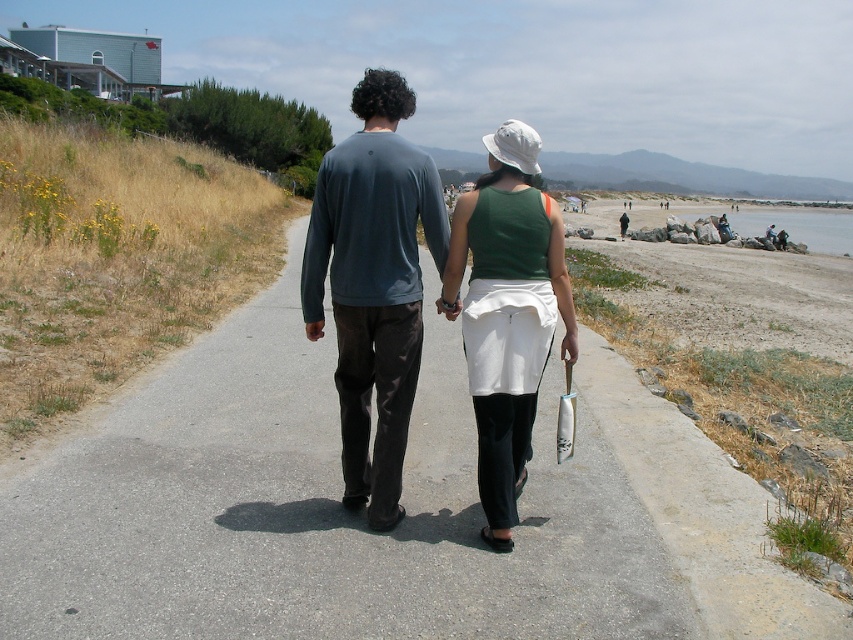
How distant is asphalt road at center from green fabric tank top at center?

asphalt road at center is 2.05 meters from green fabric tank top at center.

Is asphalt road at center positioned at the back of green fabric tank top at center?

No, asphalt road at center is closer to the viewer.

Which is in front, point (144, 458) or point (486, 204)?

Point (486, 204) is in front.

This screenshot has height=640, width=853. Identify the location of asphalt road at center. (316, 509).

Looking at this image, how distant is dark gray sweater at center from green fabric tank top at center?

dark gray sweater at center is 29.49 inches away from green fabric tank top at center.

Looking at this image, does dark gray sweater at center appear on the right side of green fabric tank top at center?

No, dark gray sweater at center is not to the right of green fabric tank top at center.

Which is in front, point (318, 332) or point (527, 394)?

Positioned in front is point (527, 394).

This screenshot has width=853, height=640. What are the coordinates of `dark gray sweater at center` in the screenshot? It's located at (373, 284).

Can you confirm if asphalt road at center is positioned above dark gray sweater at center?

No.

Can you confirm if asphalt road at center is positioned to the left of dark gray sweater at center?

Indeed, asphalt road at center is positioned on the left side of dark gray sweater at center.

Who is more distant from viewer, (253, 524) or (389, 221)?

The point (253, 524) is behind.

The height and width of the screenshot is (640, 853). I want to click on asphalt road at center, so click(x=316, y=509).